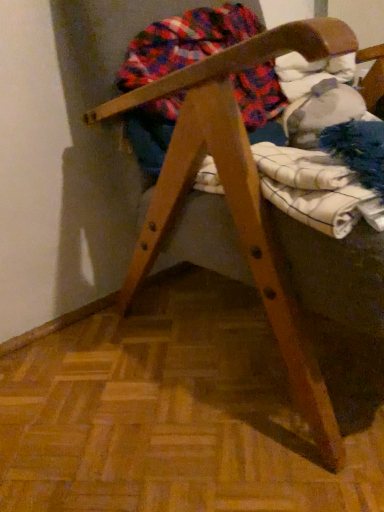
Describe the element at coordinates (238, 194) in the screenshot. I see `wooden chair at center` at that location.

The height and width of the screenshot is (512, 384). What are the coordinates of `wooden chair at center` in the screenshot? It's located at (238, 194).

The height and width of the screenshot is (512, 384). I want to click on wooden chair at center, so click(238, 194).